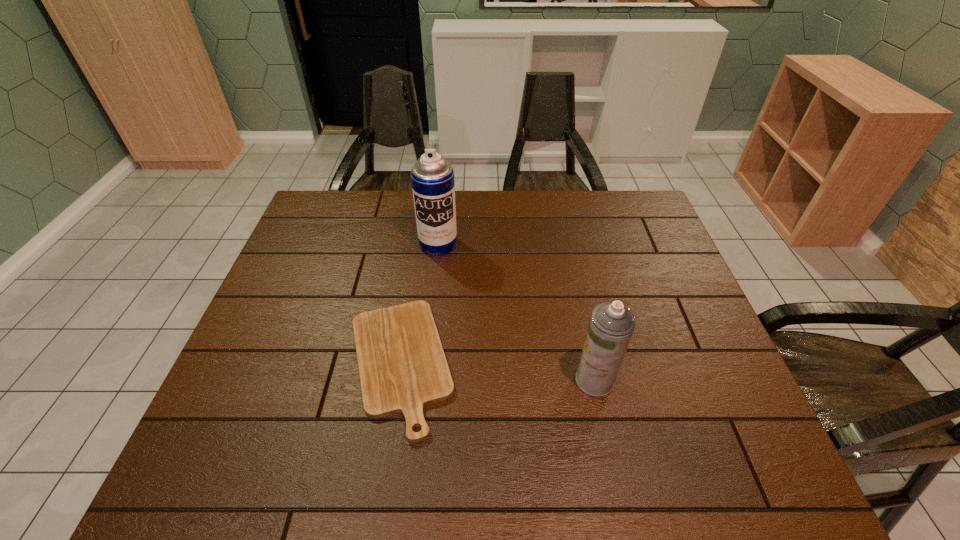
Identify the location of vacant space that is in between the tallest object and the second tallest object. The image size is (960, 540). (516, 312).

Identify which object is the closest to the right aerosol can. Please provide its 2D coordinates. Your answer should be formatted as a tuple, i.e. [(x, y)], where the tuple contains the x and y coordinates of a point satisfying the conditions above.

[(402, 366)]

Locate which object ranks in proximity to the left aerosol can. Please provide its 2D coordinates. Your answer should be formatted as a tuple, i.e. [(x, y)], where the tuple contains the x and y coordinates of a point satisfying the conditions above.

[(402, 366)]

You are a GUI agent. You are given a task and a screenshot of the screen. Output one action in this format:
    pyautogui.click(x=<x>, y=<y>)
    Task: Click on the vacant space that satisfies the following two spatial constraints: 1. on the label side of the shorter aerosol can; 2. on the right side of the taller aerosol can
    The image size is (960, 540).
    Given the screenshot: What is the action you would take?
    pyautogui.click(x=423, y=380)

The height and width of the screenshot is (540, 960). In order to click on vacant space that satisfies the following two spatial constraints: 1. on the label side of the rightmost object; 2. on the left side of the left aerosol can in this screenshot , I will do `click(423, 380)`.

Where is `blank area in the image that satisfies the following two spatial constraints: 1. on the label side of the farthest object; 2. on the right side of the shorter aerosol can`? blank area in the image that satisfies the following two spatial constraints: 1. on the label side of the farthest object; 2. on the right side of the shorter aerosol can is located at coordinates (423, 380).

You are a GUI agent. You are given a task and a screenshot of the screen. Output one action in this format:
    pyautogui.click(x=<x>, y=<y>)
    Task: Click on the free space that satisfies the following two spatial constraints: 1. on the label side of the farthest object; 2. on the right side of the rightmost object
    
    Given the screenshot: What is the action you would take?
    pyautogui.click(x=423, y=380)